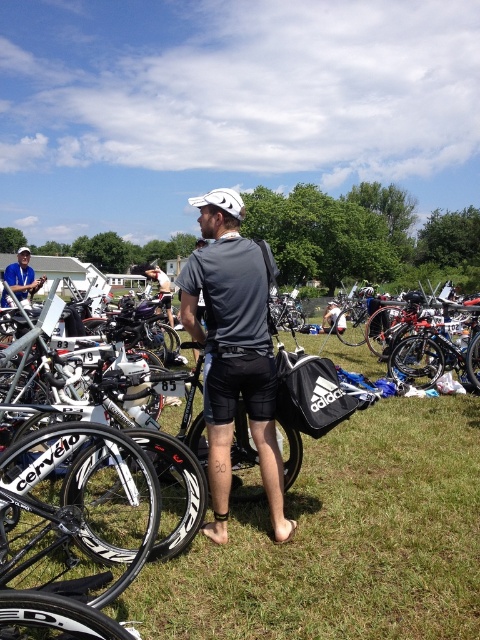
Does shiny blue frame at center have a greater width compared to matte gray shirt at center?

Incorrect, shiny blue frame at center's width does not surpass matte gray shirt at center's.

Describe the element at coordinates (424, 339) in the screenshot. This screenshot has height=640, width=480. I see `shiny blue frame at center` at that location.

Locate an element on the screen. shiny blue frame at center is located at coordinates [x=424, y=339].

Between matte gray shirt at center and matte black shorts at center, which one is positioned higher?

matte gray shirt at center is higher up.

Measure the distance from matte gray shirt at center to matte black shorts at center.

matte gray shirt at center is 4.54 meters from matte black shorts at center.

The height and width of the screenshot is (640, 480). Identify the location of matte gray shirt at center. (162, 289).

Where is `matte gray shirt at center`? matte gray shirt at center is located at coordinates (162, 289).

Who is more distant from viewer, (191, 624) or (159, 289)?

Positioned behind is point (159, 289).

Who is lower down, black matte bag at center or matte gray shirt at center?

black matte bag at center is below.

Measure the distance between black matte bag at center and camera.

black matte bag at center is 2.49 meters away from camera.

You are a GUI agent. You are given a task and a screenshot of the screen. Output one action in this format:
    pyautogui.click(x=<x>, y=<y>)
    Task: Click on the black matte bag at center
    
    Given the screenshot: What is the action you would take?
    pyautogui.click(x=343, y=541)